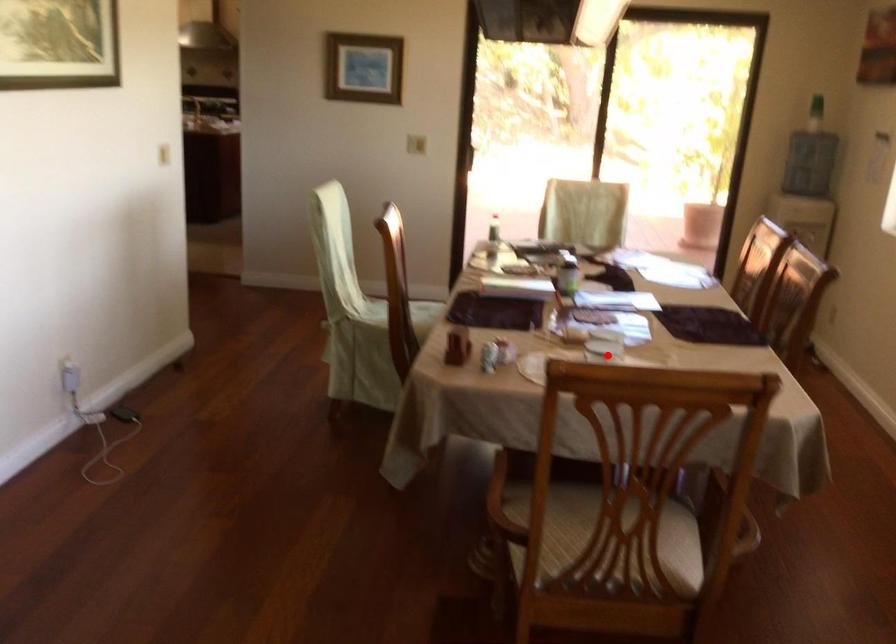
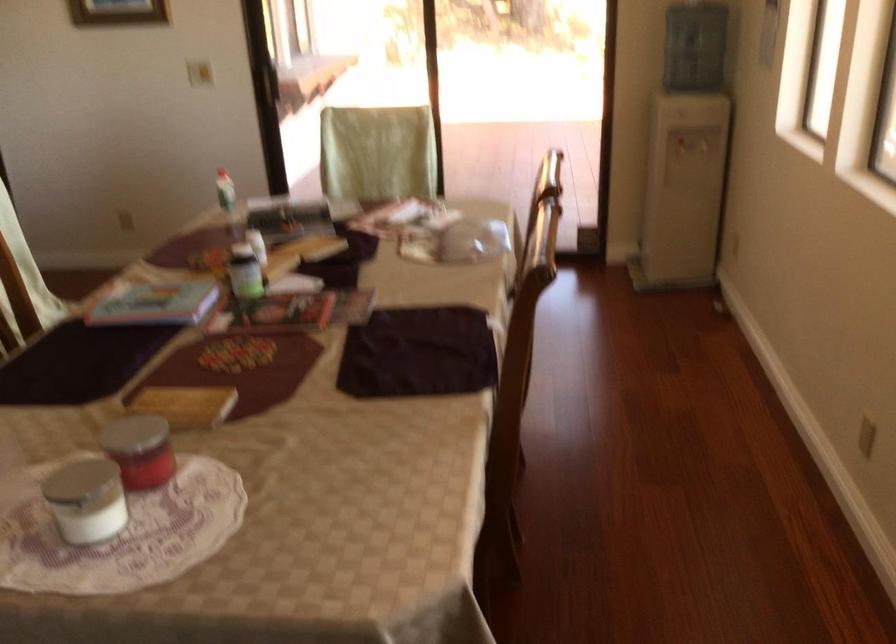
Find the pixel in the second image that matches the highlighted location in the first image.

(85, 500)